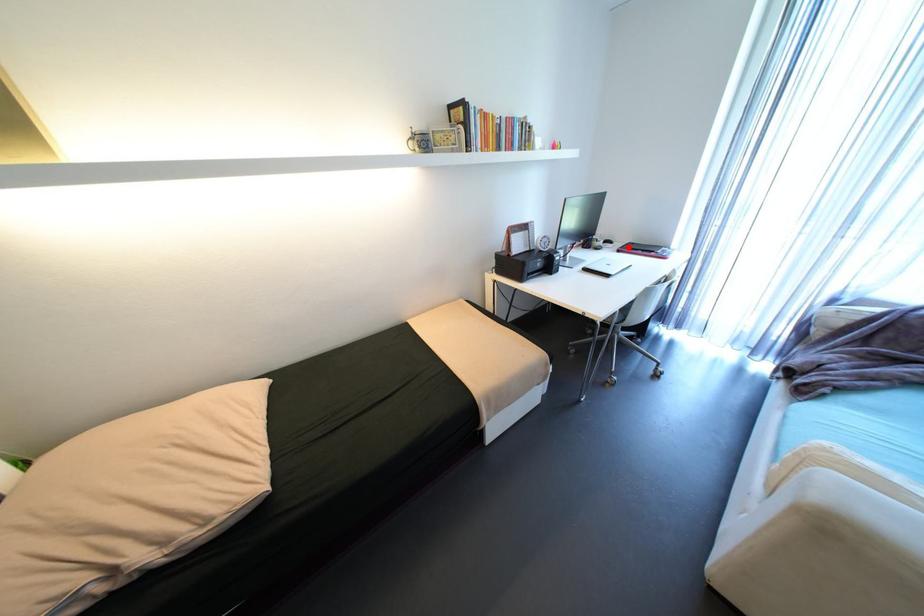
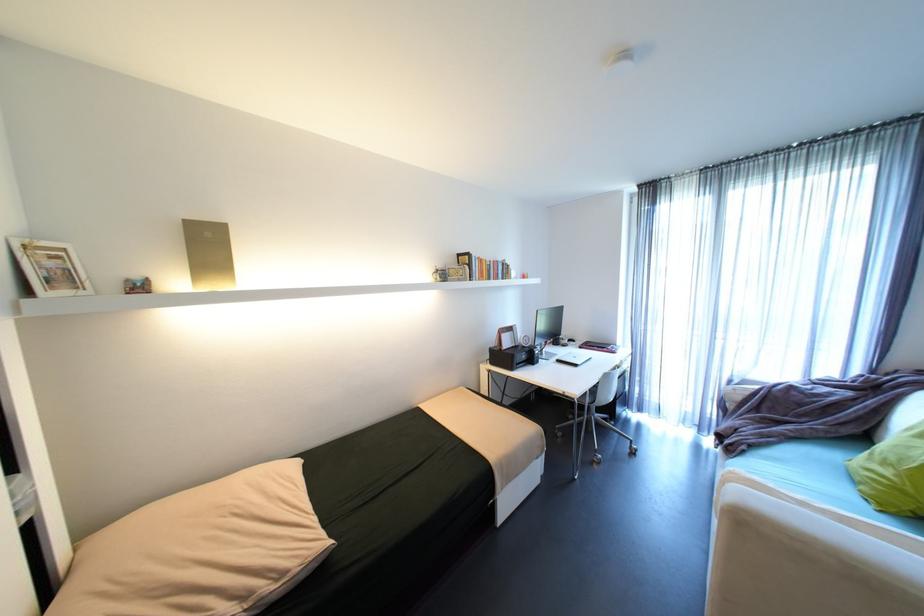
Locate, in the second image, the point that corresponds to the highlighted location in the first image.

(589, 344)